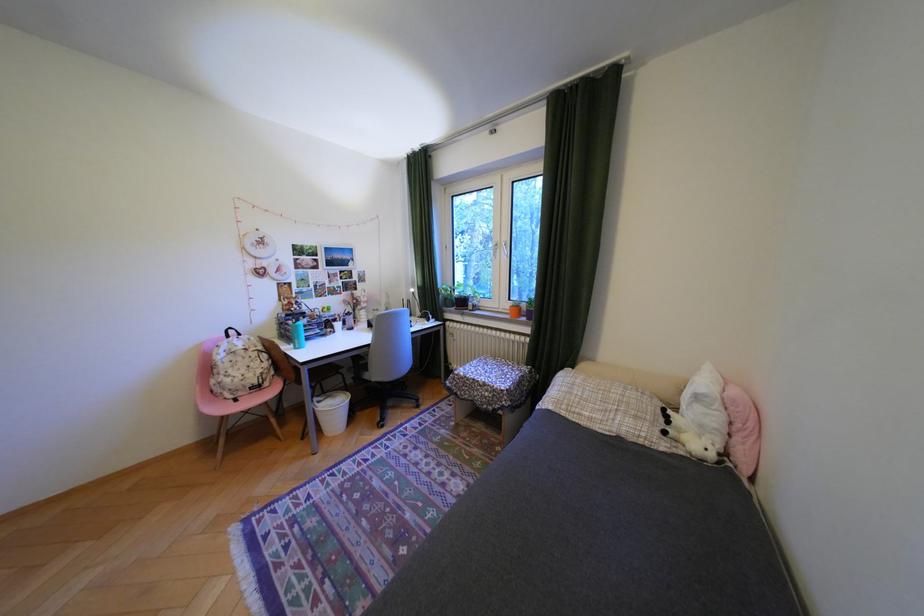
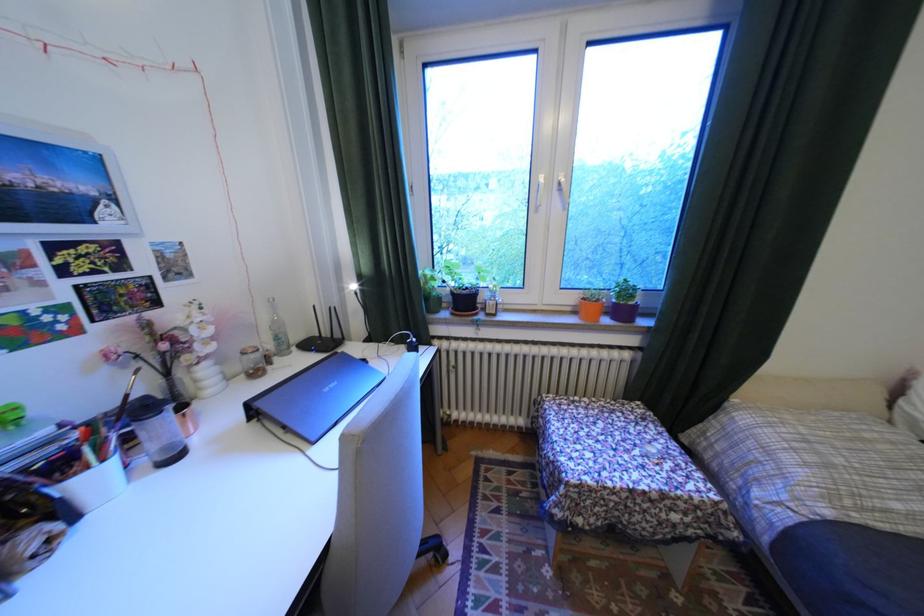
Locate, in the second image, the point that corresponds to [464,301] in the first image.

(451, 299)